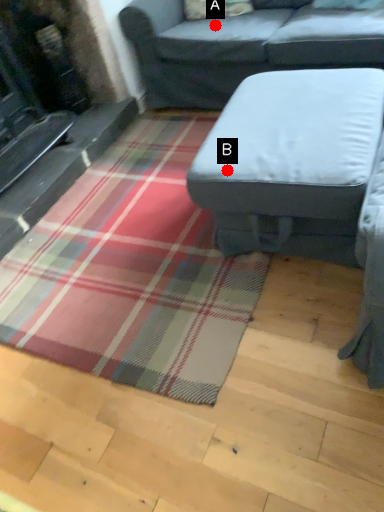
Question: Two points are circled on the image, labeled by A and B beside each circle. Which point is closer to the camera?

Choices:
 (A) A is closer
 (B) B is closer

Answer: (B)